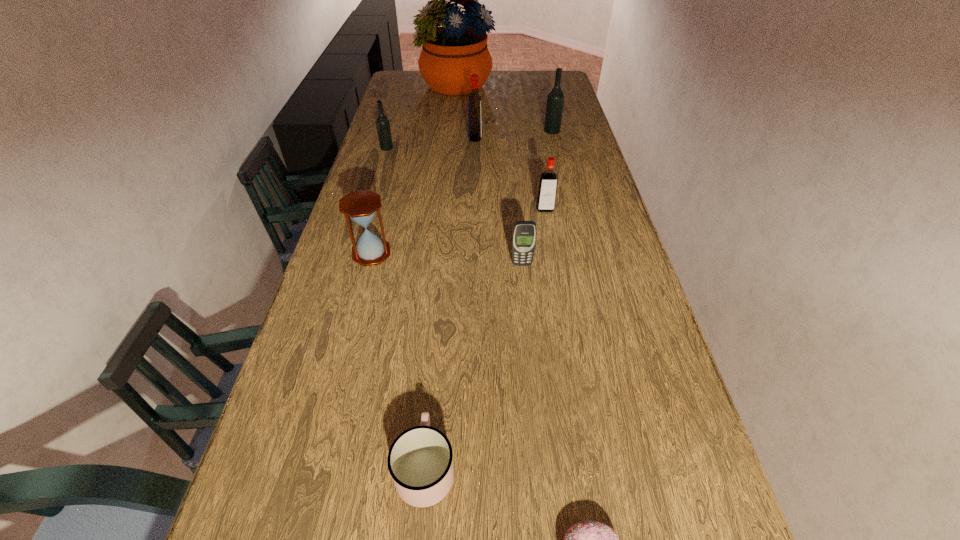
Find the location of a particular element. object that is positioned at the far left corner is located at coordinates (450, 54).

In the image, there is a desktop. Identify the location of free space at the far edge. (519, 89).

At what (x,y) coordinates should I click in order to perform the action: click on vacant area at the left edge. Please return your answer as a coordinate pair (x, y). The height and width of the screenshot is (540, 960). Looking at the image, I should click on (325, 429).

The image size is (960, 540). In the image, there is a desktop. Find the location of `blank space at the right edge`. blank space at the right edge is located at coordinates (580, 242).

The height and width of the screenshot is (540, 960). I want to click on free space between the hourglass and the farther red vodka, so click(423, 195).

I want to click on vacant area that lies between the hourglass and the eighth tallest object, so click(x=398, y=360).

Identify the location of vacant space that's between the nearer red vodka and the third vodka from right to left. (510, 174).

The width and height of the screenshot is (960, 540). Identify the location of empty location between the eighth farthest object and the gray cellular telephone. (473, 366).

Locate an element on the screen. The height and width of the screenshot is (540, 960). blank region between the gray cellular telephone and the brown hourglass is located at coordinates (446, 259).

I want to click on free space between the leftmost vodka and the smaller red vodka, so click(x=466, y=179).